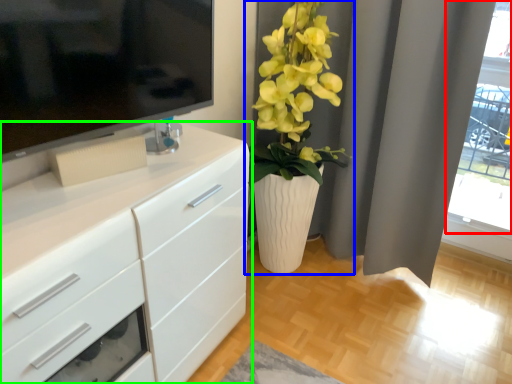
Question: Which object is the farthest from glass door (highlighted by a red box)? Choose among these: houseplant (highlighted by a blue box) or chest of drawers (highlighted by a green box).

Choices:
 (A) houseplant
 (B) chest of drawers

Answer: (B)